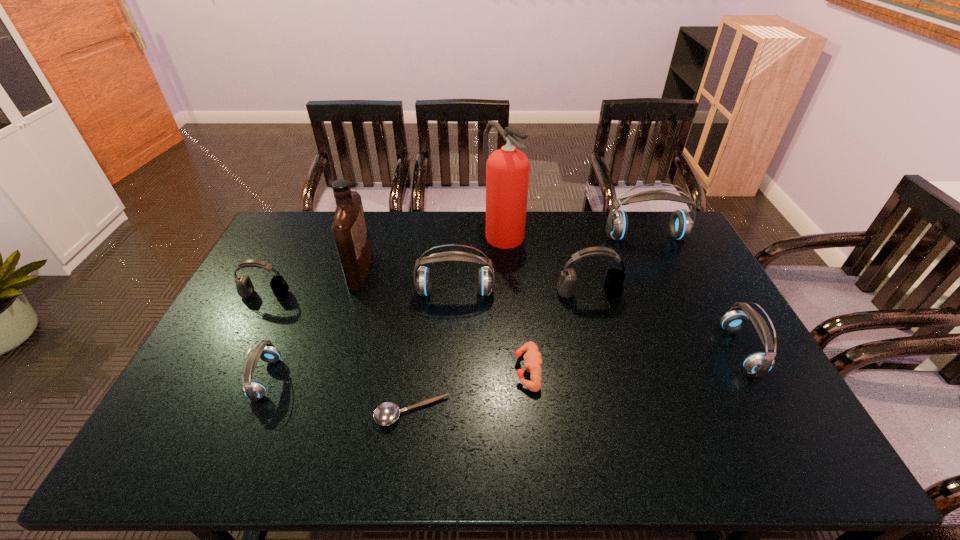
At what (x,y) coordinates should I click in order to perform the action: click on vacant area at the near left corner of the desktop. Please return your answer as a coordinate pair (x, y). The height and width of the screenshot is (540, 960). Looking at the image, I should click on (194, 439).

Where is `vacant position at the far right corner of the desktop`? The image size is (960, 540). vacant position at the far right corner of the desktop is located at coordinates (656, 236).

Image resolution: width=960 pixels, height=540 pixels. I want to click on vacant space at the near right corner, so click(x=751, y=450).

Where is `vacant space that is in between the leftmost blue headset and the fourth headset from right to left`? vacant space that is in between the leftmost blue headset and the fourth headset from right to left is located at coordinates (360, 335).

Where is `vacant point located between the third headset from left to right and the eighth object from right to left`? vacant point located between the third headset from left to right and the eighth object from right to left is located at coordinates (408, 281).

At what (x,y) coordinates should I click in order to perform the action: click on vacant space that's between the red puncher and the second biggest blue headset. Please return your answer as a coordinate pair (x, y). Image resolution: width=960 pixels, height=540 pixels. Looking at the image, I should click on (492, 331).

Locate an element on the screen. Image resolution: width=960 pixels, height=540 pixels. unoccupied area between the tallest object and the ninth object from right to left is located at coordinates (384, 305).

The width and height of the screenshot is (960, 540). In order to click on free space between the bigger black headset and the third headset from left to right in this screenshot , I will do click(x=522, y=293).

You are a GUI agent. You are given a task and a screenshot of the screen. Output one action in this format:
    pyautogui.click(x=<x>, y=<y>)
    Task: Click on the free point between the right black headset and the second shortest object
    This screenshot has width=960, height=540.
    Given the screenshot: What is the action you would take?
    pyautogui.click(x=558, y=332)

Find the location of a particular element. The height and width of the screenshot is (540, 960). empty space between the ninth tallest object and the eighth object from right to left is located at coordinates (444, 320).